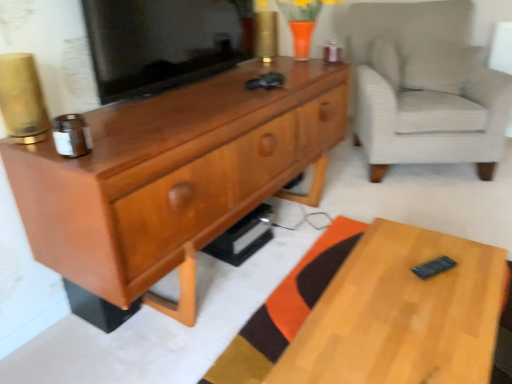
Question: In terms of height, does light wood desk at lower right look taller or shorter compared to matte wood cabinet at center?

Choices:
 (A) short
 (B) tall

Answer: (A)

Question: Considering the positions of light wood desk at lower right and matte wood cabinet at center in the image, is light wood desk at lower right bigger or smaller than matte wood cabinet at center?

Choices:
 (A) big
 (B) small

Answer: (B)

Question: Which of these objects is positioned closest to the light gray textured armchair at right?

Choices:
 (A) matte wood cabinet at center
 (B) matte black tv at center
 (C) light wood desk at lower right

Answer: (A)

Question: Which object is the closest to the light wood desk at lower right?

Choices:
 (A) light gray textured armchair at right
 (B) matte black tv at center
 (C) matte wood cabinet at center

Answer: (C)